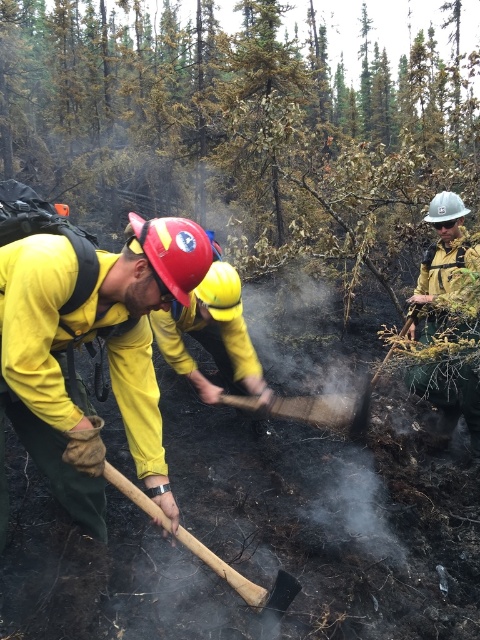
Does point (3, 476) come closer to viewer compared to point (322, 410)?

Yes, it is in front of point (322, 410).

Who is taller, matte yellow jacket at left or wooden shovel at center?

Standing taller between the two is matte yellow jacket at left.

Which is in front, point (120, 260) or point (316, 403)?

Point (120, 260)

Where is `matte yellow jacket at left`? The height and width of the screenshot is (640, 480). matte yellow jacket at left is located at coordinates (86, 342).